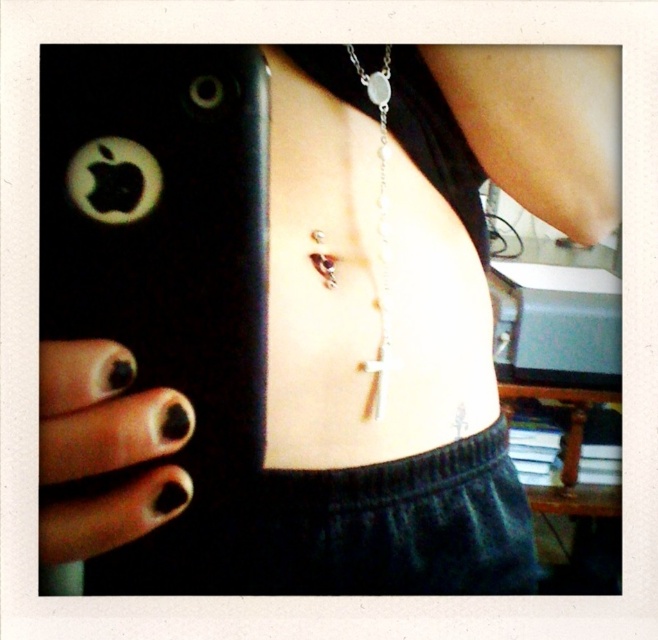
You are a jewelry designer analyzing the image. You need to determine if the black matte nails at lower left can cover the silver metallic chain at center completely when placed side by side. Based on the provided information, what is your conclusion?

The black matte nails at lower left are wider than the silver metallic chain at center, so they can cover it completely when placed side by side.

You are a photographer adjusting your camera to focus on two points in the image. The first point is point (49, 524) and the second point is point (390, 92). Which point should you focus on first if you want to capture the foreground clearly?

You should focus on point (49, 524) first because it is in front of point (390, 92), making it part of the foreground.